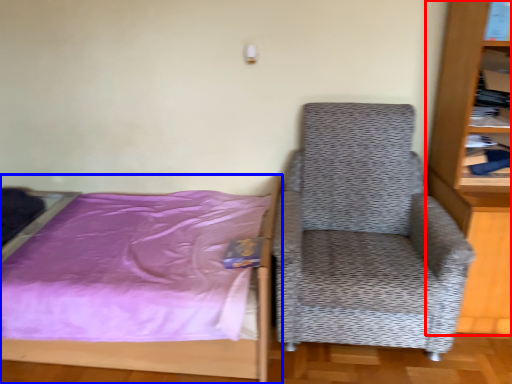
Question: Which point is further to the camera, bookcase (highlighted by a red box) or bed (highlighted by a blue box)?

Choices:
 (A) bookcase
 (B) bed

Answer: (B)